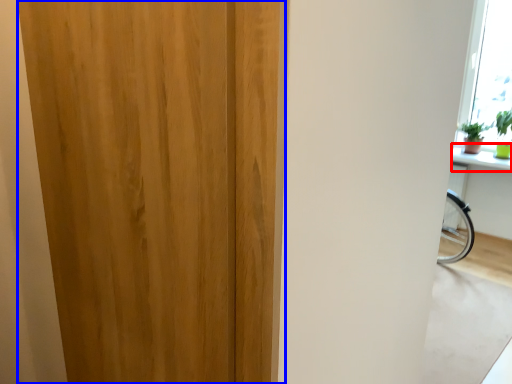
Question: Which object is closer to the camera taking this photo, window sill (highlighted by a red box) or door (highlighted by a blue box)?

Choices:
 (A) window sill
 (B) door

Answer: (B)